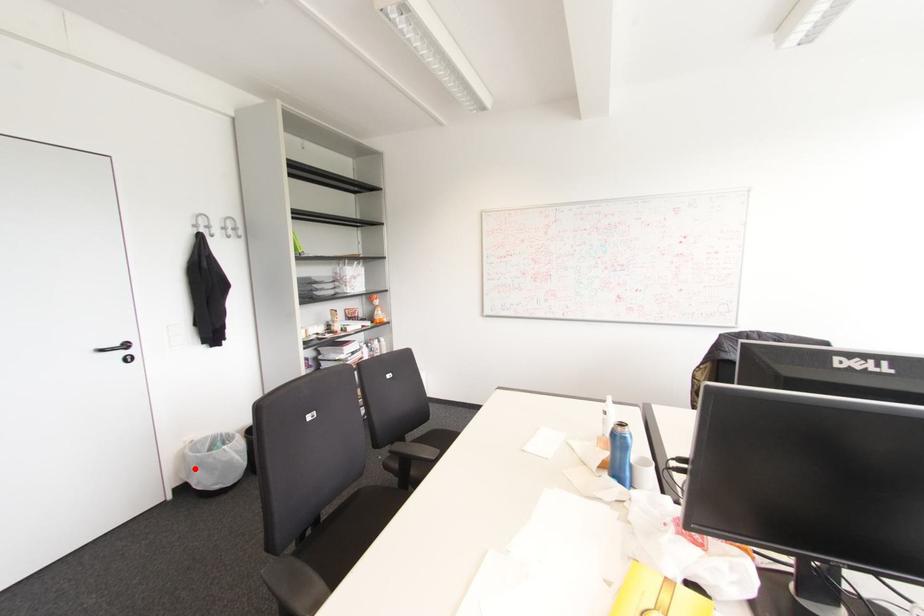
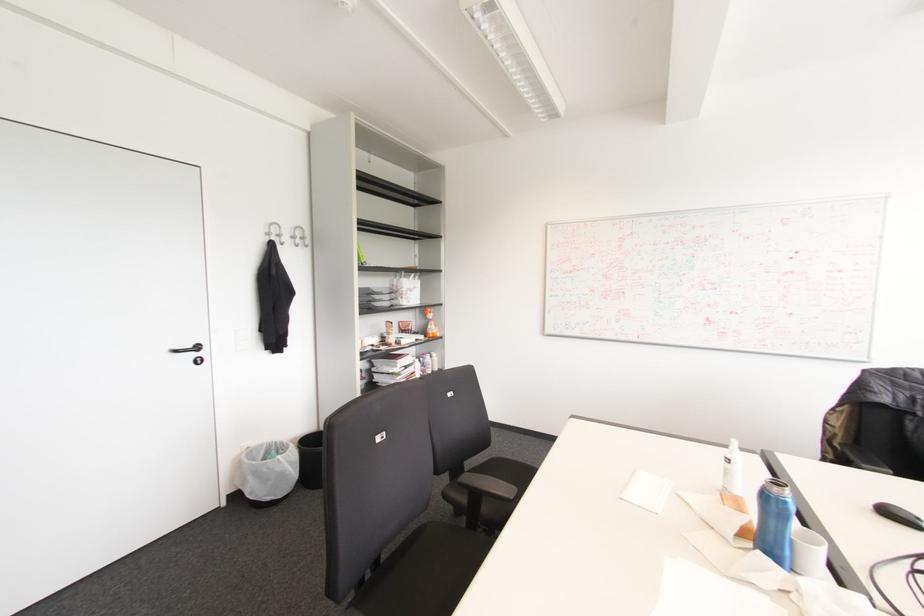
Where in the second image is the point corresponding to the highlighted location from the first image?

(249, 477)